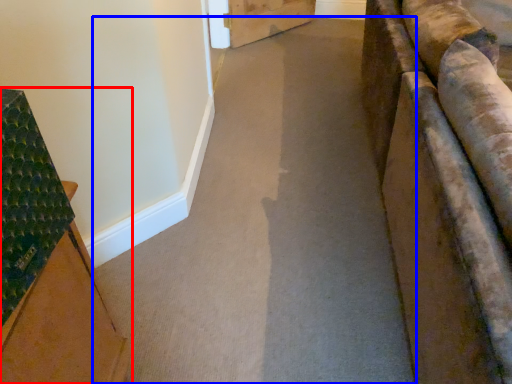
Question: Which object appears closest to the camera in this image, furniture (highlighted by a red box) or path (highlighted by a blue box)?

Choices:
 (A) furniture
 (B) path

Answer: (A)